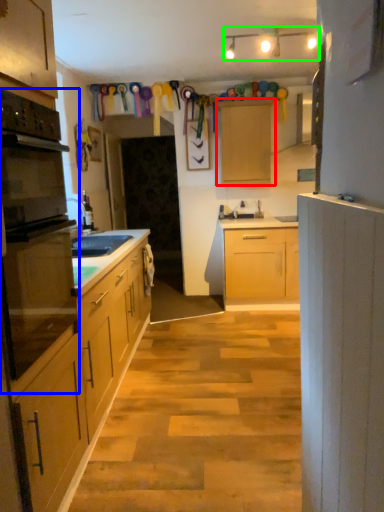
Question: Based on their relative distances, which object is nearer to cabinetry (highlighted by a red box)? Choose from oven (highlighted by a blue box) and light fixture (highlighted by a green box).

Choices:
 (A) oven
 (B) light fixture

Answer: (B)